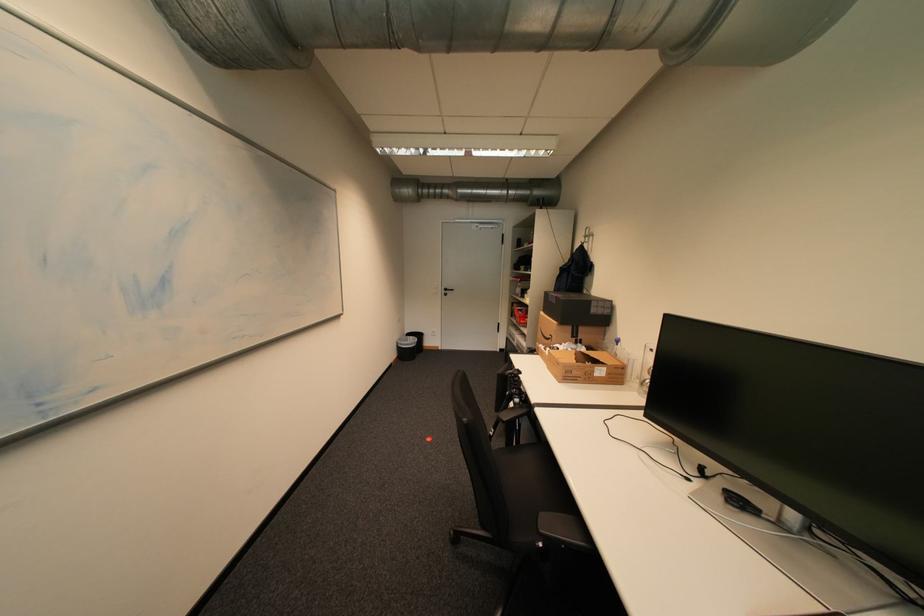
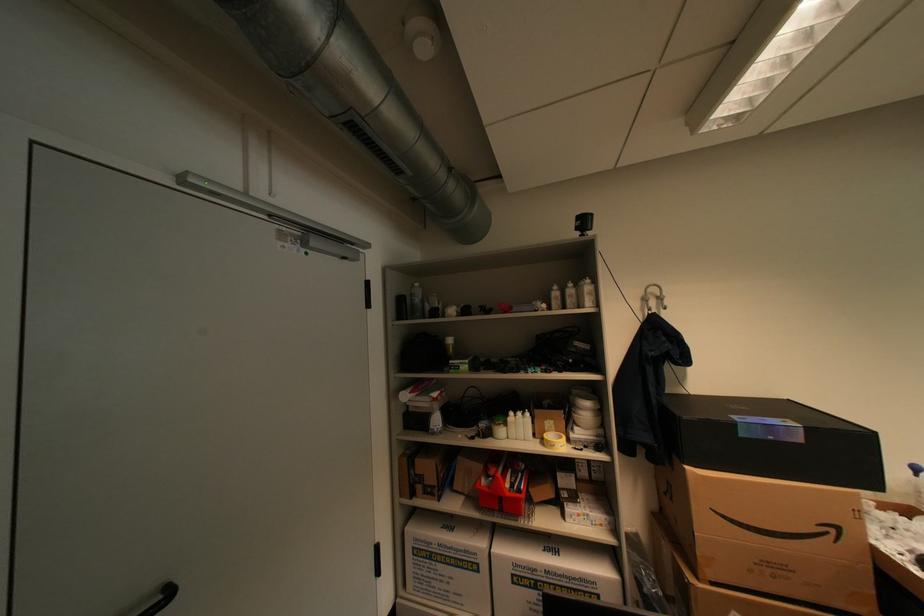
Where in the second image is the point corresponding to (x=563, y=302) from the first image?

(808, 440)